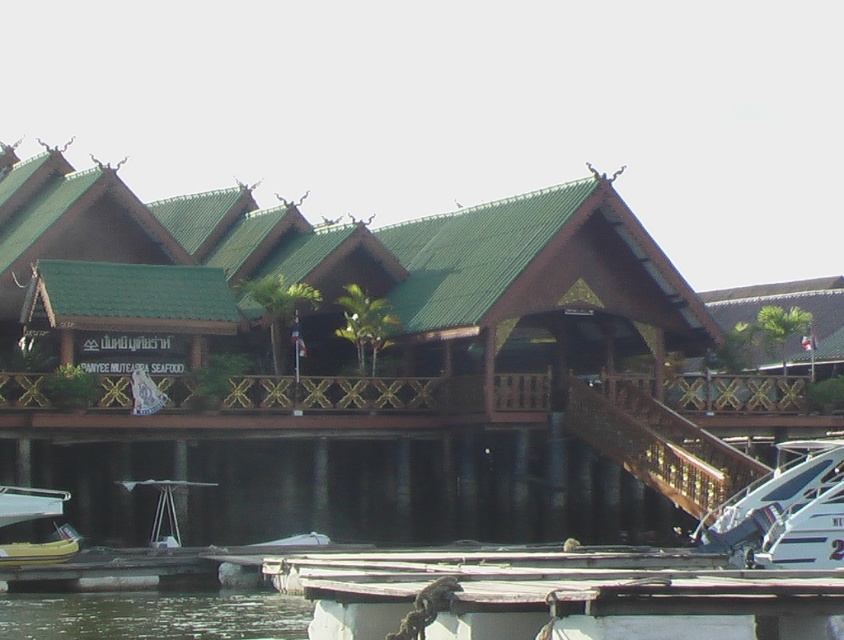
Based on the photo, measure the distance between white matte boat at lower center and yellow matte boat at lower left.

A distance of 86.31 feet exists between white matte boat at lower center and yellow matte boat at lower left.

Which is behind, point (583, 621) or point (47, 557)?

The point (47, 557) is more distant.

Does point (749, 604) come behind point (68, 540)?

No, it is not.

You are a GUI agent. You are given a task and a screenshot of the screen. Output one action in this format:
    pyautogui.click(x=<x>, y=<y>)
    Task: Click on the white matte boat at lower center
    This screenshot has width=844, height=640.
    Given the screenshot: What is the action you would take?
    pyautogui.click(x=582, y=605)

Does clear water at lower left have a smaller size compared to yellow matte boat at lower left?

No, clear water at lower left is not smaller than yellow matte boat at lower left.

Which is above, clear water at lower left or yellow matte boat at lower left?

yellow matte boat at lower left

Where is `clear water at lower left`? This screenshot has width=844, height=640. clear water at lower left is located at coordinates (152, 616).

Is white matte boat at lower center smaller than white glossy boat at lower right?

Actually, white matte boat at lower center might be larger than white glossy boat at lower right.

Can you confirm if white matte boat at lower center is positioned to the left of white glossy boat at lower right?

Yes, white matte boat at lower center is to the left of white glossy boat at lower right.

Which is behind, point (426, 600) or point (832, 449)?

The point (832, 449) is more distant.

Where is `white matte boat at lower center`? white matte boat at lower center is located at coordinates (582, 605).